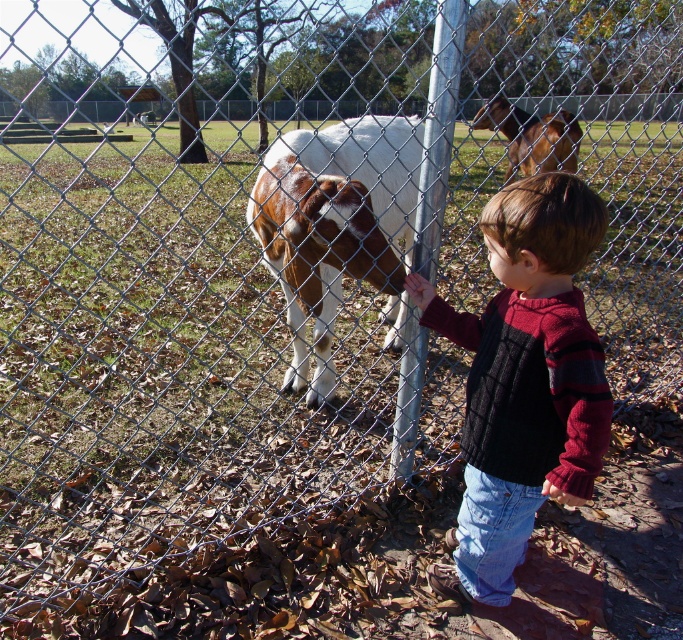
Question: Which point appears closest to the camera in this image?

Choices:
 (A) (313, 378)
 (B) (501, 112)

Answer: (A)

Question: Is knitted sweater at center closer to the viewer compared to brown glossy horse at upper center?

Choices:
 (A) no
 (B) yes

Answer: (B)

Question: Estimate the real-world distances between objects in this image. Which object is farther from the knitted sweater at center?

Choices:
 (A) brown and white fur at center
 (B) brown glossy horse at upper center

Answer: (B)

Question: Does knitted sweater at center appear on the left side of brown glossy horse at upper center?

Choices:
 (A) yes
 (B) no

Answer: (A)

Question: Can you confirm if knitted sweater at center is thinner than brown and white fur at center?

Choices:
 (A) yes
 (B) no

Answer: (A)

Question: Which point is closer to the camera taking this photo?

Choices:
 (A) (591, 248)
 (B) (281, 268)
 (C) (487, 108)

Answer: (A)